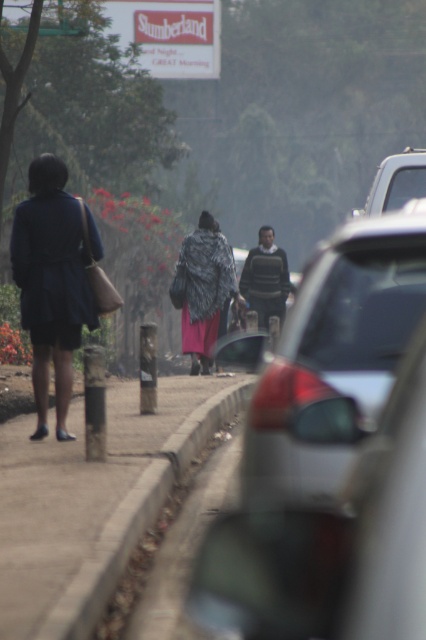
You are standing on the sidewalk and want to determine which of the two points, point (218, 417) or point (336, 348), is closer to you. Based on the scene, which point is nearer?

Point (218, 417) is closer to you because it is further to the viewer than point (336, 348).